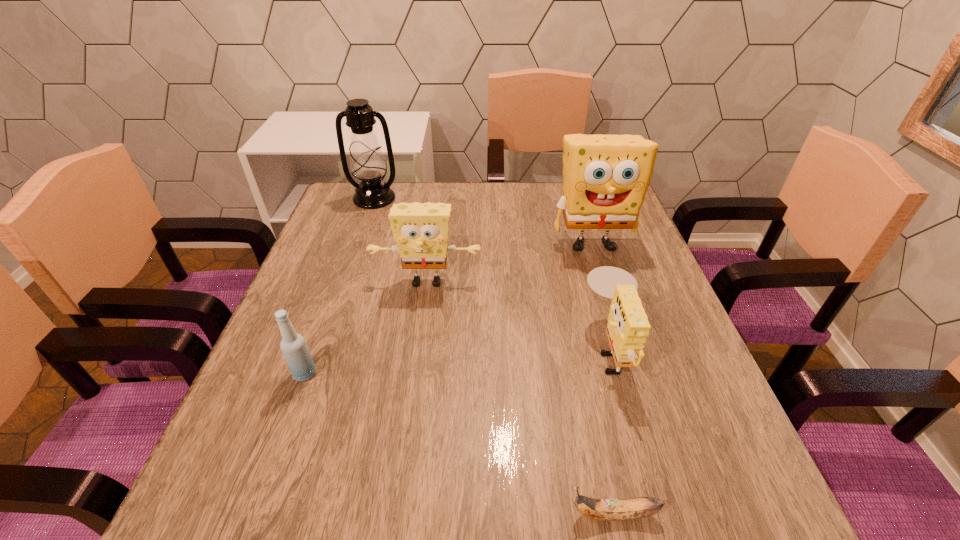
The image size is (960, 540). I want to click on sponge that is the second closest to the nearest sponge, so click(421, 230).

The height and width of the screenshot is (540, 960). Find the location of `vacant space that satisfies the following two spatial constraints: 1. on the face of the farthest sponge; 2. on the front-facing side of the shortest sponge`. vacant space that satisfies the following two spatial constraints: 1. on the face of the farthest sponge; 2. on the front-facing side of the shortest sponge is located at coordinates (627, 349).